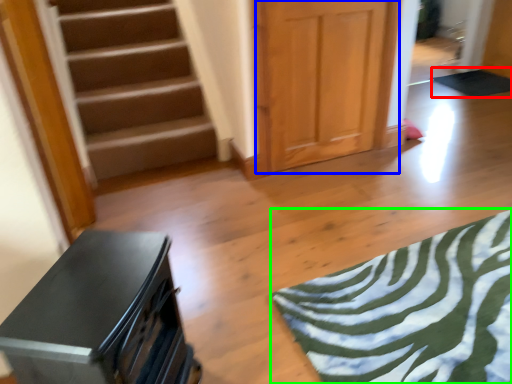
Question: Considering the real-world distances, which object is closest to yoga mat (highlighted by a red box)? door (highlighted by a blue box) or yoga mat (highlighted by a green box).

Choices:
 (A) door
 (B) yoga mat

Answer: (A)